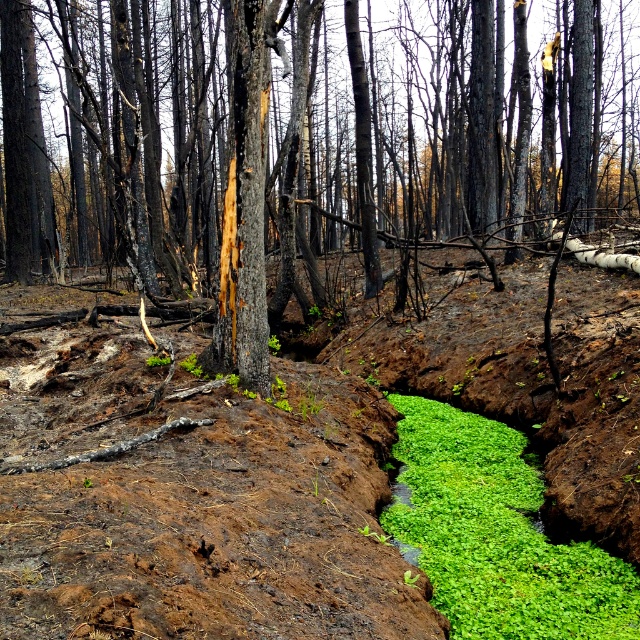
You are a firefighter assessing the fire damage in the forest. You notice two green areas at the center of the image. Which one is wider, the green mossy soil at center or the green leafy algae at center?

The green mossy soil at center might be wider than green leafy algae at center according to the description provided.

You are a firefighter assessing the fire damage in the forest. You notice the charred bark tree at center and the green mossy soil at center. Which object is taller?

The charred bark tree at center is taller than the green mossy soil at center.

Looking at this image, you are a firefighter assessing the fire damage in the forest. You notice two green spots at the center of the image, the green mossy soil at center and the green leafy algae at center. How far apart are these two areas from each other?

The green mossy soil at center is 3.99 feet from green leafy algae at center.